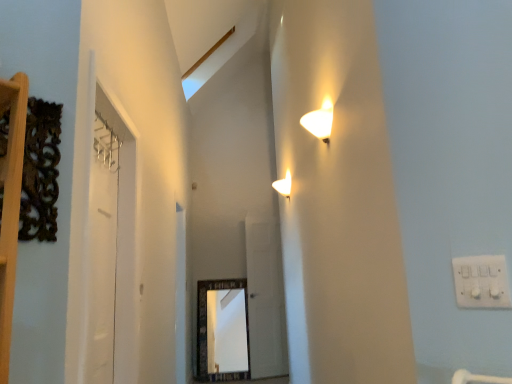
This screenshot has width=512, height=384. Describe the element at coordinates (320, 121) in the screenshot. I see `white glossy wall sconce at upper center` at that location.

Describe the element at coordinates (102, 252) in the screenshot. The width and height of the screenshot is (512, 384). I see `white glossy door at left` at that location.

This screenshot has height=384, width=512. Describe the element at coordinates (103, 244) in the screenshot. I see `clear glass door at left, which appears as the 1th glass door when viewed from the front` at that location.

Locate an element on the screen. white plastic electric outlet at upper right is located at coordinates (481, 281).

Image resolution: width=512 pixels, height=384 pixels. Identify the location of white glossy wall sconce at upper center. (320, 121).

From a real-world perspective, is white plastic electric outlet at upper right on top of white glossy wall sconce at upper center?

No, from a real-world perspective, white plastic electric outlet at upper right is not above white glossy wall sconce at upper center.

Which is less distant, (479, 270) or (309, 118)?

Point (479, 270)

Considering the relative positions of white plastic electric outlet at upper right and white glossy wall sconce at upper center in the image provided, is white plastic electric outlet at upper right behind white glossy wall sconce at upper center?

No.

Is white plastic electric outlet at upper right oriented away from white glossy wall sconce at upper center?

No, white plastic electric outlet at upper right is not facing away from white glossy wall sconce at upper center.

From the image's perspective, does transparent glass door at center, the first glass door viewed from the right, appear higher than white glossy wall sconce at upper center?

No.

Can you confirm if transparent glass door at center, the first glass door viewed from the right, is positioned to the left of white glossy wall sconce at upper center?

Correct, you'll find transparent glass door at center, the first glass door viewed from the right, to the left of white glossy wall sconce at upper center.

From a real-world perspective, is transparent glass door at center, placed as the 1th glass door when sorted from back to front, on top of white glossy wall sconce at upper center?

No, from a real-world perspective, transparent glass door at center, placed as the 1th glass door when sorted from back to front, is not on top of white glossy wall sconce at upper center.

From a real-world perspective, is white glossy door at left beneath transparent glass door at center, the second glass door in the front-to-back sequence?

No.

Does white glossy door at left appear on the right side of transparent glass door at center, the first glass door viewed from the right?

Incorrect, white glossy door at left is not on the right side of transparent glass door at center, the first glass door viewed from the right.

How many degrees apart are the facing directions of white glossy door at left and transparent glass door at center, the second glass door in the front-to-back sequence?

They differ by 74.2 degrees in their facing directions.

From the white glossy door at left, count 2nd glass door to the right and point to it. Please provide its 2D coordinates.

[(265, 299)]

Based on the photo, is white glossy wall sconce at upper center to the right of clear glass door at left, arranged as the 2th glass door when viewed from the right, from the viewer's perspective?

Yes.

Is white glossy wall sconce at upper center further to camera compared to clear glass door at left, which appears as the 1th glass door when viewed from the front?

Yes, white glossy wall sconce at upper center is further from the camera.

Is white glossy wall sconce at upper center oriented towards clear glass door at left, the second glass door positioned from the back?

Yes.

Does white glossy wall sconce at upper center have a greater width compared to clear glass door at left, arranged as the 2th glass door when viewed from the right?

Yes, white glossy wall sconce at upper center is wider than clear glass door at left, arranged as the 2th glass door when viewed from the right.

Based on the photo, is white glossy door at left inside white glossy wall sconce at upper center?

Actually, white glossy door at left is outside white glossy wall sconce at upper center.

Considering the relative sizes of white glossy wall sconce at upper center and white glossy door at left in the image provided, is white glossy wall sconce at upper center taller than white glossy door at left?

No.

Is white glossy wall sconce at upper center to the right of white glossy door at left from the viewer's perspective?

Correct, you'll find white glossy wall sconce at upper center to the right of white glossy door at left.

Does clear glass door at left, which appears as the 1th glass door when viewed from the front, have a smaller size compared to white glossy wall sconce at upper center?

Actually, clear glass door at left, which appears as the 1th glass door when viewed from the front, might be larger than white glossy wall sconce at upper center.

Who is taller, clear glass door at left, which is counted as the 1th glass door, starting from the left, or white glossy wall sconce at upper center?

Standing taller between the two is clear glass door at left, which is counted as the 1th glass door, starting from the left.

Does clear glass door at left, which appears as the 1th glass door when viewed from the front, have a greater width compared to white glossy wall sconce at upper center?

In fact, clear glass door at left, which appears as the 1th glass door when viewed from the front, might be narrower than white glossy wall sconce at upper center.

At what (x,y) coordinates should I click in order to perform the action: click on glass door in front of the white glossy door at left. Please return your answer as a coordinate pair (x, y). Looking at the image, I should click on (103, 244).

Which of these two, white glossy door at left or clear glass door at left, which appears as the 1th glass door when viewed from the front, stands taller?

clear glass door at left, which appears as the 1th glass door when viewed from the front, is taller.

How far apart are white glossy door at left and clear glass door at left, which is counted as the 1th glass door, starting from the left?

A distance of 2.78 inches exists between white glossy door at left and clear glass door at left, which is counted as the 1th glass door, starting from the left.

Looking at the image, does white glossy door at left seem bigger or smaller compared to clear glass door at left, the second glass door positioned from the back?

white glossy door at left is smaller than clear glass door at left, the second glass door positioned from the back.

Image resolution: width=512 pixels, height=384 pixels. In order to click on lamp on the left of white plastic electric outlet at upper right in this screenshot , I will do `click(320, 121)`.

Locate an element on the screen. This screenshot has width=512, height=384. lamp on the right of the transparent glass door at center, which is the second glass door from left to right is located at coordinates (320, 121).

Considering their positions, is transparent glass door at center, the second glass door in the front-to-back sequence, positioned closer to clear glass door at left, which is counted as the 1th glass door, starting from the left, than white plastic electric outlet at upper right?

The object closer to clear glass door at left, which is counted as the 1th glass door, starting from the left, is white plastic electric outlet at upper right.

Based on their spatial positions, is white glossy door at left or white glossy wall sconce at upper center further from clear glass door at left, which is counted as the 1th glass door, starting from the left?

Based on the image, white glossy wall sconce at upper center appears to be further to clear glass door at left, which is counted as the 1th glass door, starting from the left.

Based on their spatial positions, is white plastic electric outlet at upper right or transparent glass door at center, the second glass door in the front-to-back sequence, further from white glossy wall sconce at upper center?

transparent glass door at center, the second glass door in the front-to-back sequence, is further to white glossy wall sconce at upper center.

Which object lies further to the anchor point white plastic electric outlet at upper right, white glossy wall sconce at upper center or white glossy door at left?

The object further to white plastic electric outlet at upper right is white glossy door at left.

From the image, which object appears to be farther from white glossy door at left, white plastic electric outlet at upper right or transparent glass door at center, the first glass door viewed from the right?

transparent glass door at center, the first glass door viewed from the right, is further to white glossy door at left.

Considering their positions, is white glossy wall sconce at upper center positioned further to white plastic electric outlet at upper right than transparent glass door at center, the second glass door in the front-to-back sequence?

The object further to white plastic electric outlet at upper right is transparent glass door at center, the second glass door in the front-to-back sequence.

From the image, which object appears to be nearer to white glossy door at left, transparent glass door at center, the first glass door viewed from the right, or clear glass door at left, which appears as the 1th glass door when viewed from the front?

clear glass door at left, which appears as the 1th glass door when viewed from the front, is closer to white glossy door at left.

Looking at this image, based on their spatial positions, is white plastic electric outlet at upper right or white glossy wall sconce at upper center further from white glossy door at left?

Among the two, white plastic electric outlet at upper right is located further to white glossy door at left.

This screenshot has height=384, width=512. In order to click on door between white plastic electric outlet at upper right and transparent glass door at center, the first glass door viewed from the right, along the z-axis in this screenshot , I will do `click(102, 252)`.

Find the location of `lamp located between white plastic electric outlet at upper right and transparent glass door at center, placed as the 1th glass door when sorted from back to front, in the depth direction`. lamp located between white plastic electric outlet at upper right and transparent glass door at center, placed as the 1th glass door when sorted from back to front, in the depth direction is located at coordinates (320, 121).

Locate an element on the screen. The image size is (512, 384). door between clear glass door at left, which is counted as the 1th glass door, starting from the left, and transparent glass door at center, the first glass door viewed from the right, in the front-back direction is located at coordinates tap(102, 252).

You are a GUI agent. You are given a task and a screenshot of the screen. Output one action in this format:
    pyautogui.click(x=<x>, y=<y>)
    Task: Click on the glass door located between white plastic electric outlet at upper right and transparent glass door at center, placed as the 1th glass door when sorted from back to front, in the depth direction
    This screenshot has height=384, width=512.
    Given the screenshot: What is the action you would take?
    pyautogui.click(x=103, y=244)